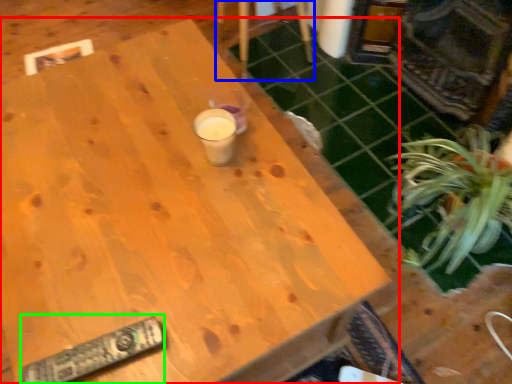
Question: Estimate the real-world distances between objects in this image. Which object is closer to table (highlighted by a red box), chair (highlighted by a blue box) or remote (highlighted by a green box)?

Choices:
 (A) chair
 (B) remote

Answer: (B)